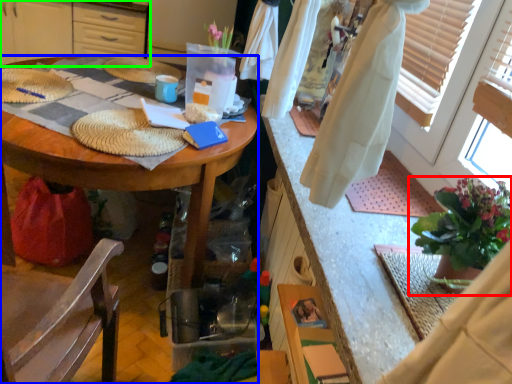
Question: Which object is the farthest from houseplant (highlighted by a red box)? Choose among these: desk (highlighted by a blue box) or cabinetry (highlighted by a green box).

Choices:
 (A) desk
 (B) cabinetry

Answer: (B)